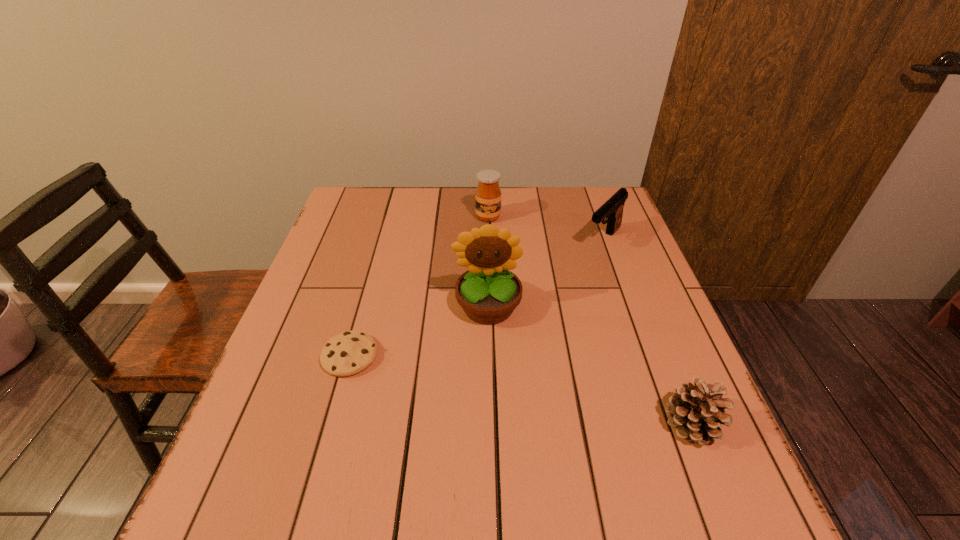
I want to click on vacant space on the desktop that is between the shortest object and the pinecone and is positioned on the front-facing side of the honey, so click(543, 394).

You are a GUI agent. You are given a task and a screenshot of the screen. Output one action in this format:
    pyautogui.click(x=<x>, y=<y>)
    Task: Click on the free space on the desktop that is between the fourth farthest object and the second shortest object and is positioned on the face of the third nearest object
    The image size is (960, 540).
    Given the screenshot: What is the action you would take?
    pyautogui.click(x=492, y=384)

Where is `free space on the desktop that is between the leftmost object and the nearest object and is positioned at the barrel of the pistol`? Image resolution: width=960 pixels, height=540 pixels. free space on the desktop that is between the leftmost object and the nearest object and is positioned at the barrel of the pistol is located at coordinates coord(469,380).